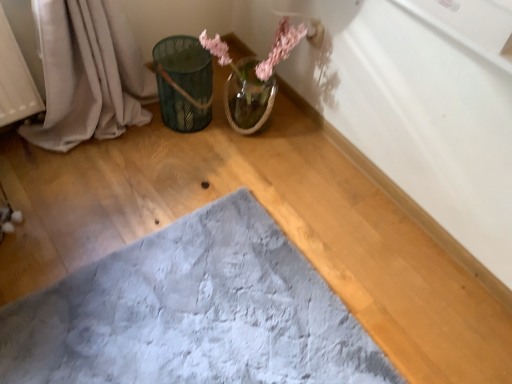
Question: Considering the relative positions of soft gray plush bath mat at center and translucent glass vase at upper center in the image provided, is soft gray plush bath mat at center to the left of translucent glass vase at upper center from the viewer's perspective?

Choices:
 (A) yes
 (B) no

Answer: (A)

Question: Is soft gray plush bath mat at center with translucent glass vase at upper center?

Choices:
 (A) no
 (B) yes

Answer: (A)

Question: From a real-world perspective, is soft gray plush bath mat at center below translucent glass vase at upper center?

Choices:
 (A) yes
 (B) no

Answer: (A)

Question: From a real-world perspective, is soft gray plush bath mat at center physically above translucent glass vase at upper center?

Choices:
 (A) yes
 (B) no

Answer: (B)

Question: Are soft gray plush bath mat at center and translucent glass vase at upper center located far from each other?

Choices:
 (A) yes
 (B) no

Answer: (B)

Question: In terms of size, does soft gray plush bath mat at center appear bigger or smaller than translucent glass vase at upper center?

Choices:
 (A) small
 (B) big

Answer: (A)

Question: In terms of width, does soft gray plush bath mat at center look wider or thinner when compared to translucent glass vase at upper center?

Choices:
 (A) wide
 (B) thin

Answer: (A)

Question: Does point (262, 241) appear closer or farther from the camera than point (279, 46)?

Choices:
 (A) farther
 (B) closer

Answer: (B)

Question: Considering their positions, is soft gray plush bath mat at center located in front of or behind translucent glass vase at upper center?

Choices:
 (A) behind
 (B) front

Answer: (B)

Question: From the image's perspective, is translucent glass vase at upper center positioned above or below green metallic bucket at upper left?

Choices:
 (A) above
 (B) below

Answer: (A)

Question: Is translucent glass vase at upper center to the left or to the right of green metallic bucket at upper left in the image?

Choices:
 (A) right
 (B) left

Answer: (A)

Question: From a real-world perspective, relative to green metallic bucket at upper left, is translucent glass vase at upper center vertically above or below?

Choices:
 (A) above
 (B) below

Answer: (A)

Question: Considering the positions of translucent glass vase at upper center and green metallic bucket at upper left in the image, is translucent glass vase at upper center bigger or smaller than green metallic bucket at upper left?

Choices:
 (A) big
 (B) small

Answer: (A)

Question: From their relative heights in the image, would you say green metallic bucket at upper left is taller or shorter than soft gray plush bath mat at center?

Choices:
 (A) short
 (B) tall

Answer: (B)

Question: Would you say green metallic bucket at upper left is to the left or to the right of soft gray plush bath mat at center in the picture?

Choices:
 (A) left
 (B) right

Answer: (A)